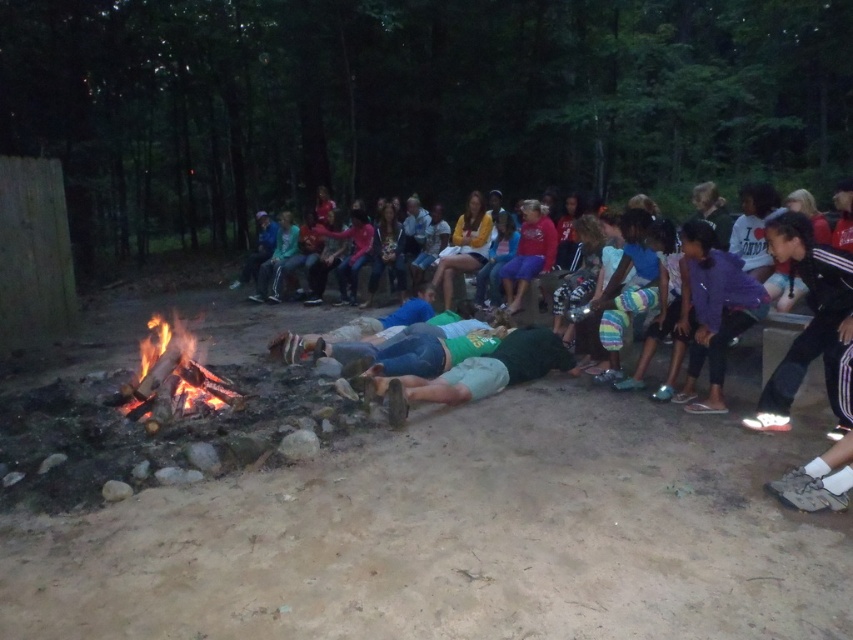
You are standing at the campfire and want to move to a point closer to you. Which point should you go to, point (701,262) or point (149,346)?

Point (701,262) is closer to the viewer than point (149,346), so you should go to point (701,262).

You are standing at the edge of the campfire and want to hand a marshmallow to the person wearing the green fabric shirt at center. Based on their position relative to the campfire, in which direction should you move to reach them?

The green fabric shirt at center is located at point 0.673 on the x and 0.980 on the y axis, so you should move towards the upper right direction to reach them.

You are a camp counselor responsible for ensuring safety around the campfire. You notice a person wearing a green fabric shirt at center near the flaming wood fire at center. According to safety guidelines, people should stay at least 5 feet away from the fire. Is the person positioned safely?

The green fabric shirt at center is 4.60 feet from the flaming wood fire at center. Since the required safe distance is 5 feet, the person is too close and needs to move back to maintain a safe distance.